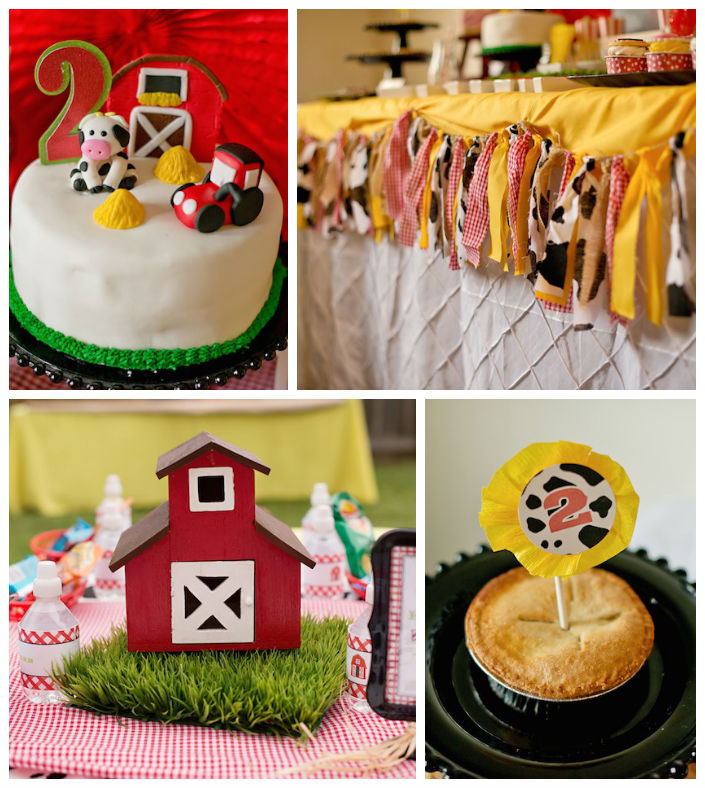
Find the location of a particular element. 3 tiered serving tray is located at coordinates (392, 20), (391, 50), (369, 87).